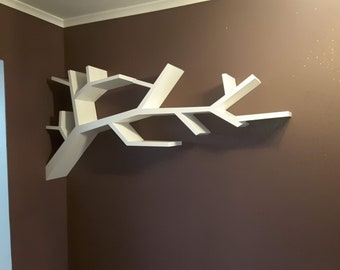
Find the location of a particular element. The image size is (340, 270). ceiling is located at coordinates (71, 5).